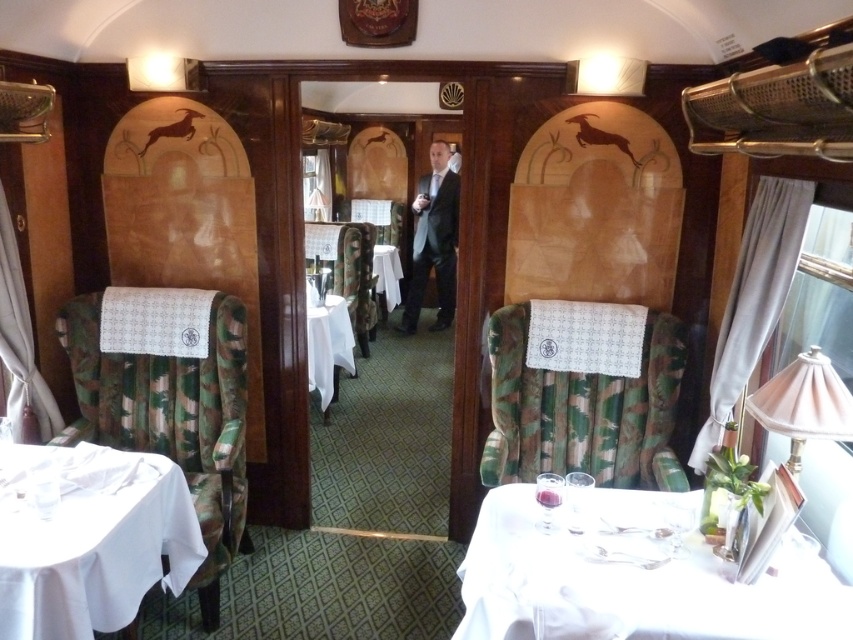
Who is more forward, (x=537, y=564) or (x=399, y=272)?

Point (x=537, y=564) is more forward.

Does point (578, 580) lie in front of point (387, 262)?

That is True.

This screenshot has height=640, width=853. Identify the location of white cloth at lower right. (625, 589).

This screenshot has width=853, height=640. Identify the location of white cloth at lower right. (625, 589).

What do you see at coordinates (90, 538) in the screenshot?
I see `white cloth table at lower left` at bounding box center [90, 538].

Is white cloth table at lower left bigger than white cloth-covered table at center?

Yes, white cloth table at lower left is bigger than white cloth-covered table at center.

Which is behind, point (125, 467) or point (340, 364)?

Positioned behind is point (340, 364).

This screenshot has height=640, width=853. In order to click on white cloth table at lower left in this screenshot , I will do `click(90, 538)`.

Can you confirm if white cloth-covered table at center is shorter than white cloth at center?

In fact, white cloth-covered table at center may be taller than white cloth at center.

Which is more to the right, white cloth-covered table at center or white cloth at center?

Positioned to the right is white cloth at center.

Does point (335, 364) come behind point (397, 284)?

No, (335, 364) is closer to viewer.

You are a GUI agent. You are given a task and a screenshot of the screen. Output one action in this format:
    pyautogui.click(x=<x>, y=<y>)
    Task: Click on the white cloth-covered table at center
    This screenshot has width=853, height=640.
    Given the screenshot: What is the action you would take?
    pyautogui.click(x=328, y=346)